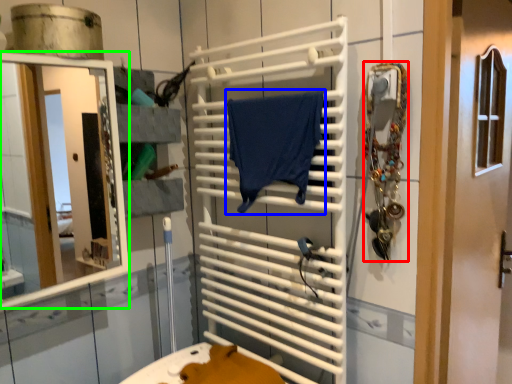
Question: Which is farther away from accessory (highlighted by a red box)? bath towel (highlighted by a blue box) or mirror (highlighted by a green box)?

Choices:
 (A) bath towel
 (B) mirror

Answer: (B)